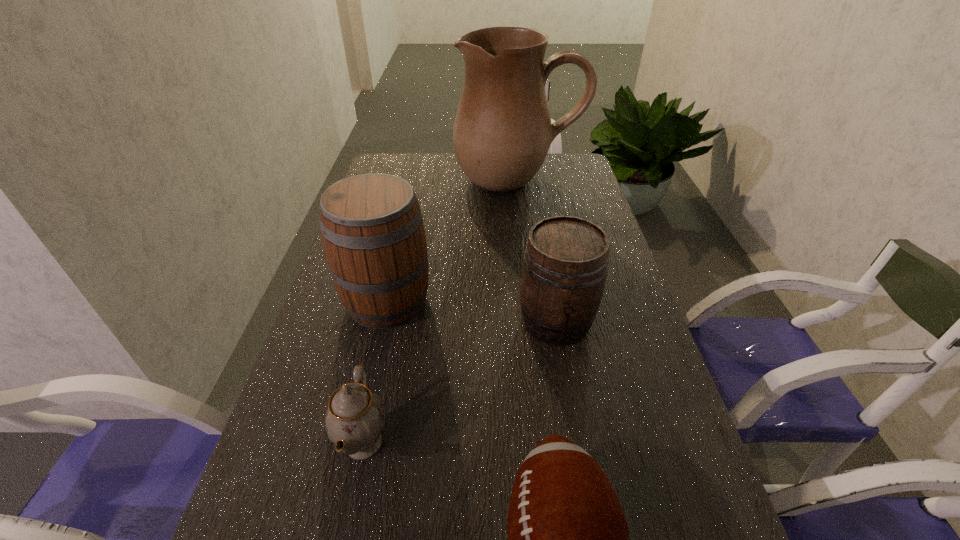
Locate an element on the screen. blank space at the far right corner is located at coordinates (550, 181).

Find the location of a particular element. The width and height of the screenshot is (960, 540). free space that is in between the farthest object and the second tallest object is located at coordinates (452, 240).

The height and width of the screenshot is (540, 960). In order to click on vacant point located between the farthest object and the chinaware in this screenshot , I will do `click(441, 312)`.

Where is `vacant region between the chinaware and the farthest object`? The width and height of the screenshot is (960, 540). vacant region between the chinaware and the farthest object is located at coordinates (441, 312).

Locate an element on the screen. free space between the right cider and the chinaware is located at coordinates (460, 382).

This screenshot has width=960, height=540. Identify the location of vacant area that lies between the taller cider and the farthest object. (452, 240).

You are a GUI agent. You are given a task and a screenshot of the screen. Output one action in this format:
    pyautogui.click(x=<x>, y=<y>)
    Task: Click on the empty location between the cream pitcher and the taller cider
    This screenshot has height=540, width=960.
    Given the screenshot: What is the action you would take?
    pyautogui.click(x=452, y=240)

Identify which object is the fourth nearest to the football. Please provide its 2D coordinates. Your answer should be formatted as a tuple, i.e. [(x, y)], where the tuple contains the x and y coordinates of a point satisfying the conditions above.

[(502, 132)]

At what (x,y) coordinates should I click in order to perform the action: click on the closest object relative to the football. Please return your answer as a coordinate pair (x, y). This screenshot has width=960, height=540. Looking at the image, I should click on (355, 418).

In order to click on blank space that satisfies the following two spatial constraints: 1. on the side of the right cider near the bung hole; 2. on the spout of the chinaware in this screenshot , I will do 577,443.